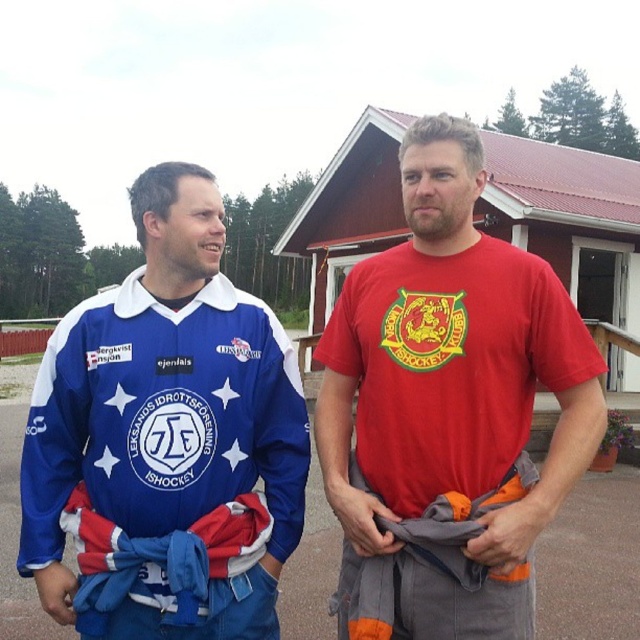
Question: Can you confirm if blue jersey at center is thinner than red matte t-shirt at center?

Choices:
 (A) yes
 (B) no

Answer: (B)

Question: Among these points, which one is farthest from the camera?

Choices:
 (A) (195, 490)
 (B) (472, 264)

Answer: (B)

Question: Does blue jersey at center lie behind red matte t-shirt at center?

Choices:
 (A) no
 (B) yes

Answer: (B)

Question: Does blue jersey at center come in front of red matte t-shirt at center?

Choices:
 (A) no
 (B) yes

Answer: (A)